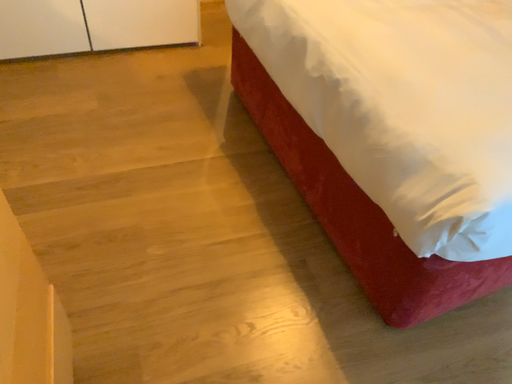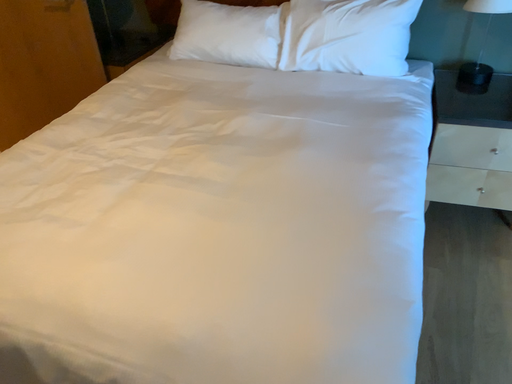
Question: Which way did the camera rotate in the video?

Choices:
 (A) rotated right
 (B) rotated left

Answer: (A)